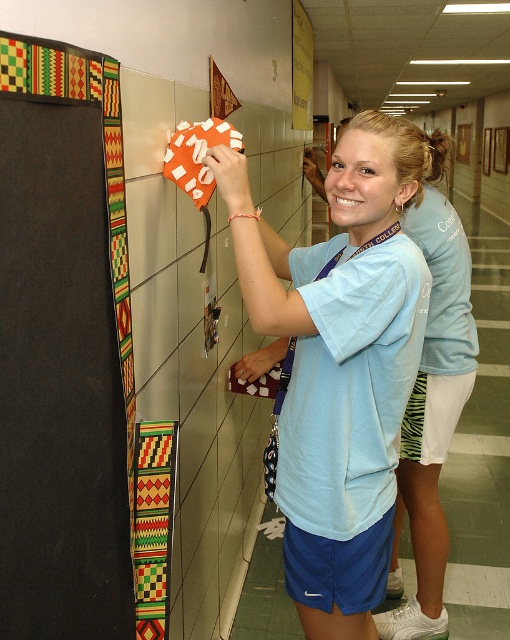
The width and height of the screenshot is (510, 640). What do you see at coordinates (349, 392) in the screenshot? I see `light blue fabric scrub at center` at bounding box center [349, 392].

Who is positioned more to the right, light blue fabric scrub at center or matte blue shirt at center?

Positioned to the right is matte blue shirt at center.

Where is `light blue fabric scrub at center`? This screenshot has width=510, height=640. light blue fabric scrub at center is located at coordinates (349, 392).

Is point (89, 515) closer to viewer compared to point (353, 248)?

Yes, point (89, 515) is closer to viewer.

This screenshot has width=510, height=640. What do you see at coordinates (64, 348) in the screenshot?
I see `black fabric at left` at bounding box center [64, 348].

Identify the location of black fabric at left. (64, 348).

Which is more to the left, black fabric at left or light blue fabric scrub at center?

black fabric at left

Does black fabric at left come behind light blue fabric scrub at center?

No, it is not.

Who is more distant from viewer, (45, 532) or (288, 445)?

Point (288, 445)

You are a GUI agent. You are given a task and a screenshot of the screen. Output one action in this format:
    pyautogui.click(x=<x>, y=<y>)
    Task: Click on the black fabric at left
    
    Given the screenshot: What is the action you would take?
    pyautogui.click(x=64, y=348)